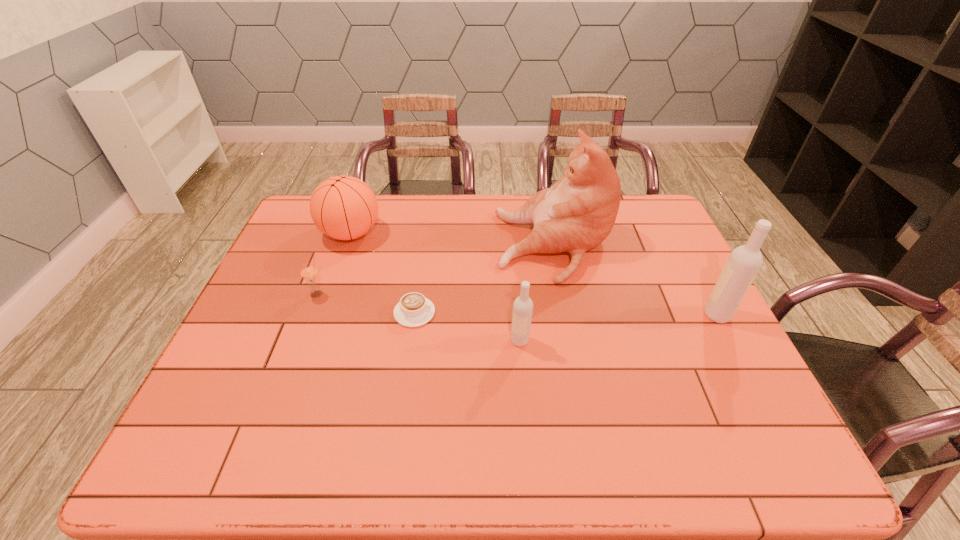
At what (x,y) coordinates should I click in order to perform the action: click on vacant spot to place a vodka on the left. Please return your answer as a coordinate pair (x, y). The image size is (960, 540). Looking at the image, I should click on (299, 369).